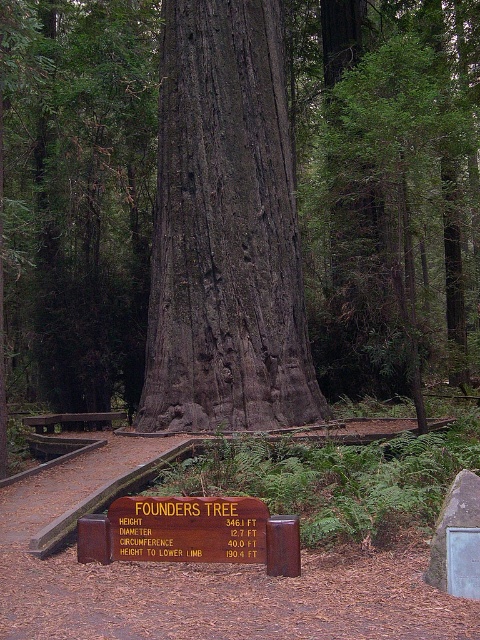
Which is below, dark brown bark tree at center or brown wooden sign at center?

brown wooden sign at center is below.

Based on the photo, who is more distant from viewer, (468, 369) or (210, 556)?

Point (468, 369)

Is point (364, 296) positioned before point (259, 554)?

No.

The width and height of the screenshot is (480, 640). Identify the location of dark brown bark tree at center. [x=394, y=202].

Identify the location of dark gray bark tree at center. This screenshot has height=640, width=480. (226, 230).

Based on the photo, who is lower down, dark gray bark tree at center or dark brown bark tree at center?

Positioned lower is dark gray bark tree at center.

At what (x,y) coordinates should I click in order to perform the action: click on dark gray bark tree at center. Please return your answer as a coordinate pair (x, y). Looking at the image, I should click on (226, 230).

In order to click on dark gray bark tree at center in this screenshot , I will do `click(226, 230)`.

Is dark gray bark tree at center in front of brown wooden bench at center?

Yes, dark gray bark tree at center is closer to the viewer.

Is point (259, 86) closer to viewer compared to point (112, 420)?

Yes.

Between point (196, 93) and point (101, 419), which one is positioned behind?

The point (101, 419) is more distant.

The width and height of the screenshot is (480, 640). Identify the location of dark gray bark tree at center. (226, 230).